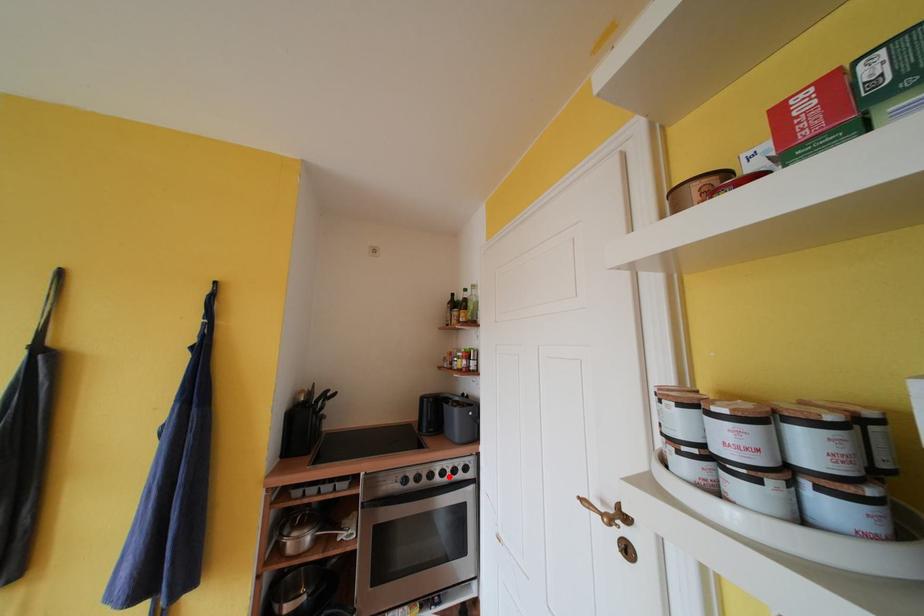
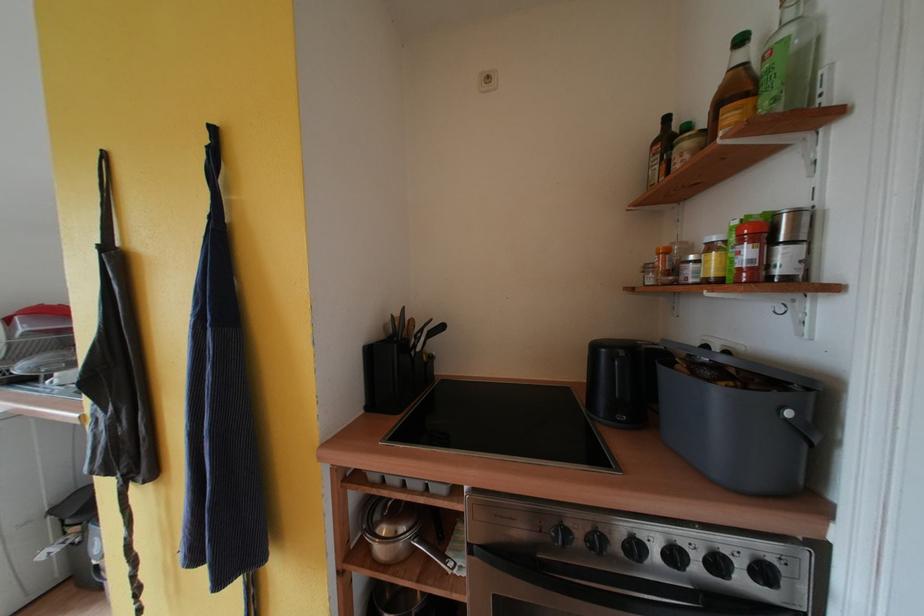
Locate, in the second image, the point that corresponds to the highlighted location in the first image.

(681, 560)